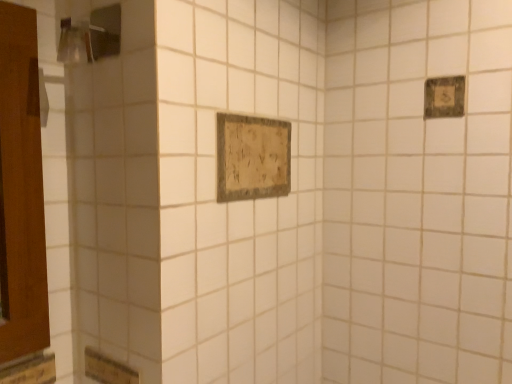
Measure the distance between brushed metal shower at upper left and camera.

A distance of 33.43 inches exists between brushed metal shower at upper left and camera.

How much space does wooden plaque at upper right, acting as the first rectangle starting from the top, occupy horizontally?

The width of wooden plaque at upper right, acting as the first rectangle starting from the top, is 0.71 inches.

How much space does distressed wood sign at center, arranged as the 1th rectangle when viewed from the left, occupy vertically?

8.35 inches.

Identify the location of brushed metal shower at upper left. (90, 36).

In terms of width, does wooden plaque at upper right, which is the 2th rectangle from bottom to top, look wider or thinner when compared to distressed wood sign at center, which is counted as the second rectangle, starting from the right?

Clearly, wooden plaque at upper right, which is the 2th rectangle from bottom to top, has less width compared to distressed wood sign at center, which is counted as the second rectangle, starting from the right.

Who is shorter, wooden plaque at upper right, which is the 1th rectangle in right-to-left order, or distressed wood sign at center, which is counted as the second rectangle, starting from the right?

Standing shorter between the two is wooden plaque at upper right, which is the 1th rectangle in right-to-left order.

The height and width of the screenshot is (384, 512). What are the coordinates of `rectangle on the left of wooden plaque at upper right, which is the 2th rectangle from bottom to top` in the screenshot? It's located at (252, 157).

In the scene shown: Considering the relative positions of wooden plaque at upper right, acting as the first rectangle starting from the top, and distressed wood sign at center, which is the 1th rectangle in bottom-to-top order, in the image provided, is wooden plaque at upper right, acting as the first rectangle starting from the top, to the left of distressed wood sign at center, which is the 1th rectangle in bottom-to-top order, from the viewer's perspective?

In fact, wooden plaque at upper right, acting as the first rectangle starting from the top, is to the right of distressed wood sign at center, which is the 1th rectangle in bottom-to-top order.

Is brushed metal shower at upper left to the left of wooden plaque at upper right, which is the 2th rectangle from bottom to top, from the viewer's perspective?

Yes.

You are a GUI agent. You are given a task and a screenshot of the screen. Output one action in this format:
    pyautogui.click(x=<x>, y=<y>)
    Task: Click on the rectangle that is the 2nd object located behind the brushed metal shower at upper left
    Image resolution: width=512 pixels, height=384 pixels.
    Given the screenshot: What is the action you would take?
    pyautogui.click(x=444, y=97)

Considering the relative sizes of brushed metal shower at upper left and wooden plaque at upper right, which is the 2th rectangle from bottom to top, in the image provided, is brushed metal shower at upper left bigger than wooden plaque at upper right, which is the 2th rectangle from bottom to top,?

Indeed, brushed metal shower at upper left has a larger size compared to wooden plaque at upper right, which is the 2th rectangle from bottom to top.

Which of these two, brushed metal shower at upper left or wooden plaque at upper right, positioned as the 2th rectangle in left-to-right order, stands shorter?

wooden plaque at upper right, positioned as the 2th rectangle in left-to-right order.

You are a GUI agent. You are given a task and a screenshot of the screen. Output one action in this format:
    pyautogui.click(x=<x>, y=<y>)
    Task: Click on the shower above the distressed wood sign at center, arranged as the 1th rectangle when viewed from the left (from the image's perspective)
    The width and height of the screenshot is (512, 384).
    Given the screenshot: What is the action you would take?
    [x=90, y=36]

From a real-world perspective, is brushed metal shower at upper left beneath distressed wood sign at center, arranged as the 1th rectangle when viewed from the left?

No.

Between point (103, 14) and point (257, 123), which one is positioned behind?

Point (257, 123)

From the image's perspective, which is above, brushed metal shower at upper left or distressed wood sign at center, which is the 1th rectangle in bottom-to-top order?

brushed metal shower at upper left, from the image's perspective.

From a real-world perspective, is distressed wood sign at center, arranged as the 1th rectangle when viewed from the left, above or below wooden plaque at upper right, positioned as the 2th rectangle in left-to-right order?

distressed wood sign at center, arranged as the 1th rectangle when viewed from the left, is situated lower than wooden plaque at upper right, positioned as the 2th rectangle in left-to-right order, in the real world.

Based on the photo, does distressed wood sign at center, which is the 1th rectangle in bottom-to-top order, touch wooden plaque at upper right, which is the 1th rectangle in right-to-left order?

They are not placed beside each other.

Would you say distressed wood sign at center, acting as the second rectangle starting from the top, contains wooden plaque at upper right, which is the 2th rectangle from bottom to top?

That's incorrect, wooden plaque at upper right, which is the 2th rectangle from bottom to top, is not inside distressed wood sign at center, acting as the second rectangle starting from the top.

Considering the positions of objects distressed wood sign at center, which is counted as the second rectangle, starting from the right, and wooden plaque at upper right, which is the 1th rectangle in right-to-left order, in the image provided, who is more to the right, distressed wood sign at center, which is counted as the second rectangle, starting from the right, or wooden plaque at upper right, which is the 1th rectangle in right-to-left order,?

wooden plaque at upper right, which is the 1th rectangle in right-to-left order.

In terms of height, does wooden plaque at upper right, positioned as the 2th rectangle in left-to-right order, look taller or shorter compared to brushed metal shower at upper left?

In the image, wooden plaque at upper right, positioned as the 2th rectangle in left-to-right order, appears to be shorter than brushed metal shower at upper left.

Can you see wooden plaque at upper right, which is the 1th rectangle in right-to-left order, touching brushed metal shower at upper left?

No, wooden plaque at upper right, which is the 1th rectangle in right-to-left order, is not next to brushed metal shower at upper left.

Between distressed wood sign at center, which is counted as the second rectangle, starting from the right, and brushed metal shower at upper left, which one has less height?

With less height is brushed metal shower at upper left.

From the image's perspective, is distressed wood sign at center, acting as the second rectangle starting from the top, positioned above or below brushed metal shower at upper left?

Clearly, from the image's perspective, distressed wood sign at center, acting as the second rectangle starting from the top, is below brushed metal shower at upper left.

From a real-world perspective, is distressed wood sign at center, which is counted as the second rectangle, starting from the right, under brushed metal shower at upper left?

Yes, from a real-world perspective, distressed wood sign at center, which is counted as the second rectangle, starting from the right, is below brushed metal shower at upper left.

Which object is wider, distressed wood sign at center, acting as the second rectangle starting from the top, or brushed metal shower at upper left?

brushed metal shower at upper left.

This screenshot has width=512, height=384. What are the coordinates of `rectangle in front of the wooden plaque at upper right, acting as the first rectangle starting from the top` in the screenshot? It's located at (252, 157).

Locate an element on the screen. The height and width of the screenshot is (384, 512). shower above the wooden plaque at upper right, positioned as the 2th rectangle in left-to-right order (from a real-world perspective) is located at coordinates (90, 36).

Based on their spatial positions, is brushed metal shower at upper left or distressed wood sign at center, arranged as the 1th rectangle when viewed from the left, closer to wooden plaque at upper right, acting as the first rectangle starting from the top?

distressed wood sign at center, arranged as the 1th rectangle when viewed from the left, is closer to wooden plaque at upper right, acting as the first rectangle starting from the top.

Considering their positions, is wooden plaque at upper right, acting as the first rectangle starting from the top, positioned further to brushed metal shower at upper left than distressed wood sign at center, arranged as the 1th rectangle when viewed from the left?

wooden plaque at upper right, acting as the first rectangle starting from the top, lies further to brushed metal shower at upper left than the other object.

Which object lies nearer to the anchor point wooden plaque at upper right, which is the 2th rectangle from bottom to top, distressed wood sign at center, which is the 1th rectangle in bottom-to-top order, or brushed metal shower at upper left?

distressed wood sign at center, which is the 1th rectangle in bottom-to-top order, is positioned closer to the anchor wooden plaque at upper right, which is the 2th rectangle from bottom to top.

Estimate the real-world distances between objects in this image. Which object is closer to distressed wood sign at center, arranged as the 1th rectangle when viewed from the left, wooden plaque at upper right, which is the 2th rectangle from bottom to top, or brushed metal shower at upper left?

brushed metal shower at upper left lies closer to distressed wood sign at center, arranged as the 1th rectangle when viewed from the left, than the other object.

Considering their positions, is distressed wood sign at center, arranged as the 1th rectangle when viewed from the left, positioned further to brushed metal shower at upper left than wooden plaque at upper right, which is the 2th rectangle from bottom to top?

wooden plaque at upper right, which is the 2th rectangle from bottom to top, lies further to brushed metal shower at upper left than the other object.

Based on their spatial positions, is brushed metal shower at upper left or wooden plaque at upper right, which is the 2th rectangle from bottom to top, closer to distressed wood sign at center, which is the 1th rectangle in bottom-to-top order?

brushed metal shower at upper left is closer to distressed wood sign at center, which is the 1th rectangle in bottom-to-top order.

Where is `rectangle between brushed metal shower at upper left and wooden plaque at upper right, which is the 1th rectangle in right-to-left order, in the horizontal direction`? rectangle between brushed metal shower at upper left and wooden plaque at upper right, which is the 1th rectangle in right-to-left order, in the horizontal direction is located at coordinates (252, 157).